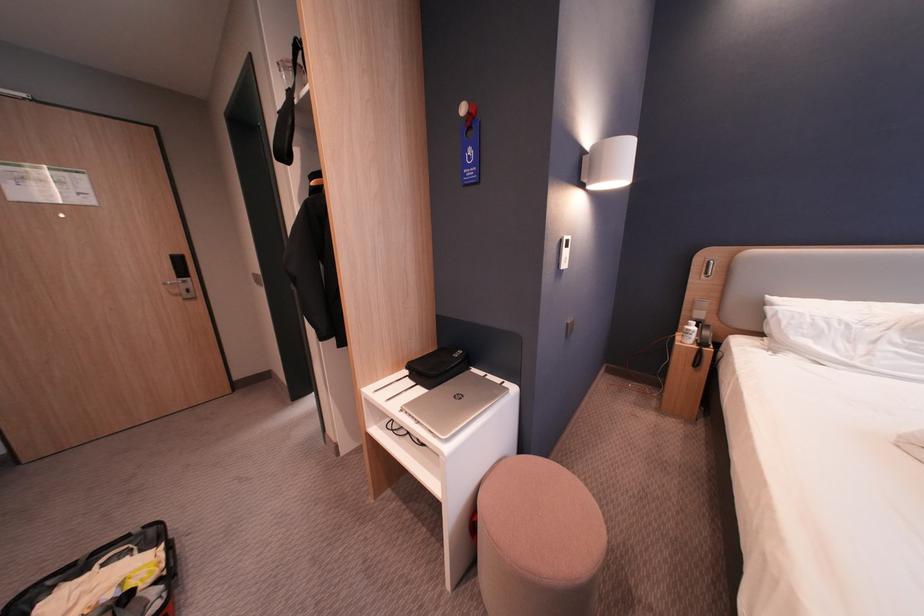
Locate an element on the screen. The width and height of the screenshot is (924, 616). black telephone handset is located at coordinates (436, 367).